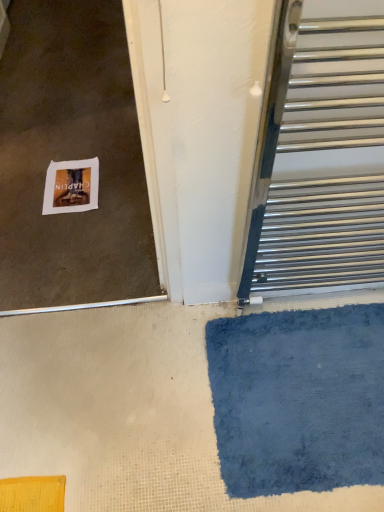
This screenshot has height=512, width=384. In order to click on empty space that is ontop of white paper at lower left (from a real-world perspective) in this screenshot , I will do `click(67, 184)`.